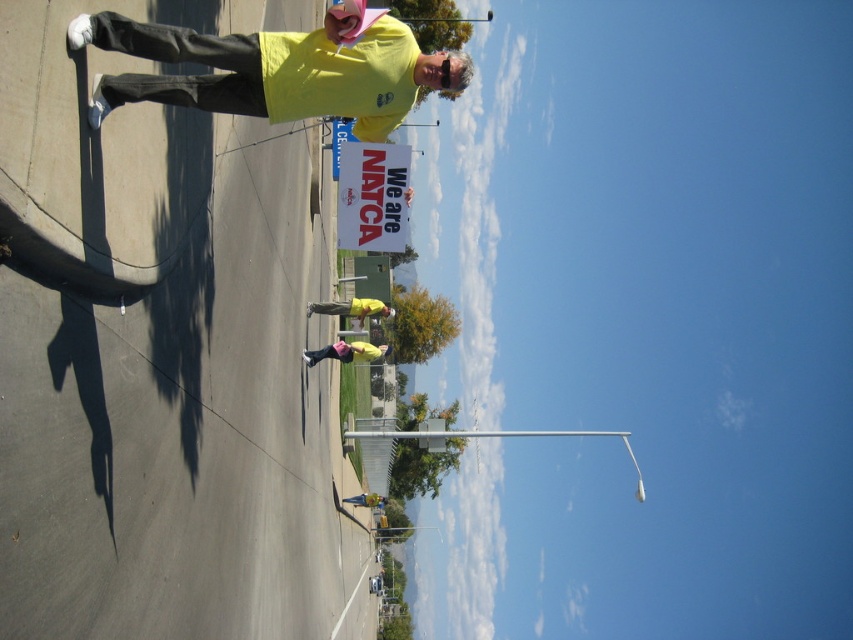
You are a photographer trying to capture a group photo of the yellow matte shirt at center and the pink fabric at center. If you want to ensure both subjects are fully visible in the frame, which subject should you position closer to the camera to avoid cropping?

The yellow matte shirt at center should be positioned closer to the camera because it is wider than the pink fabric at center, ensuring both can fit within the frame without cropping.

You are standing on the paved road and see the pink fabric at center and the yellow fabric shirt at center. Which fabric is located to the right of the other?

The pink fabric at center is positioned on the right side of yellow fabric shirt at center.